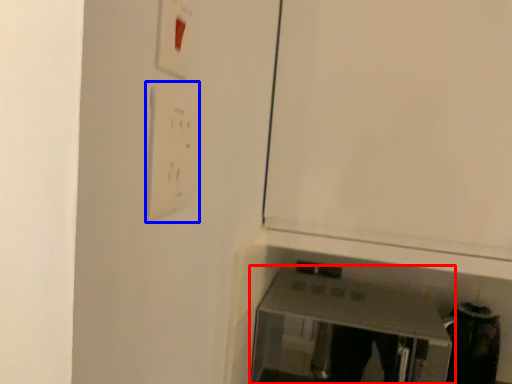
Question: Which object appears closest to the camera in this image, furniture (highlighted by a red box) or light switch (highlighted by a blue box)?

Choices:
 (A) furniture
 (B) light switch

Answer: (B)